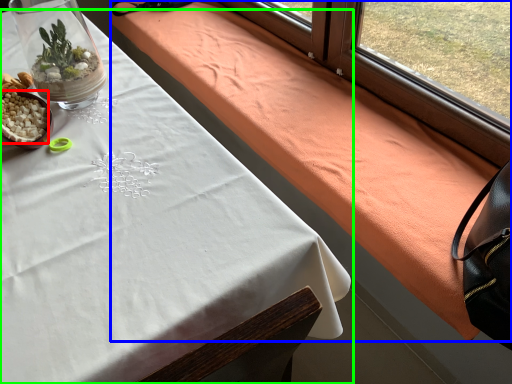
Question: Estimate the real-world distances between objects in this image. Which object is closer to food (highlighted by a red box), blanket (highlighted by a blue box) or table (highlighted by a green box)?

Choices:
 (A) blanket
 (B) table

Answer: (B)